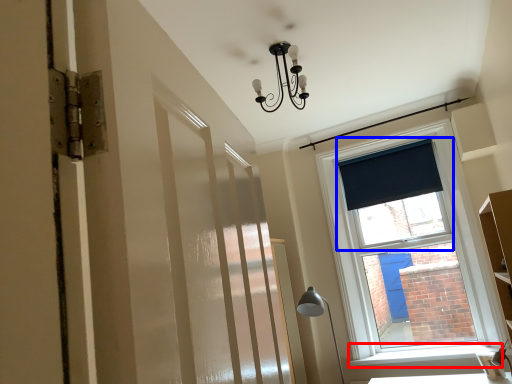
Question: Which object appears farthest to the camera in this image, window sill (highlighted by a red box) or window screen (highlighted by a blue box)?

Choices:
 (A) window sill
 (B) window screen

Answer: (B)